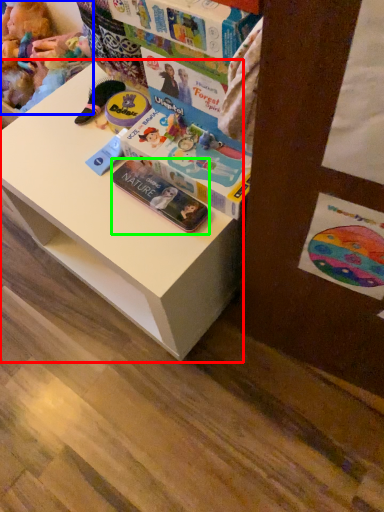
Question: Based on their relative distances, which object is nearer to changing table (highlighted by a red box)? Choose from toy (highlighted by a blue box) and paperback book (highlighted by a green box).

Choices:
 (A) toy
 (B) paperback book

Answer: (B)